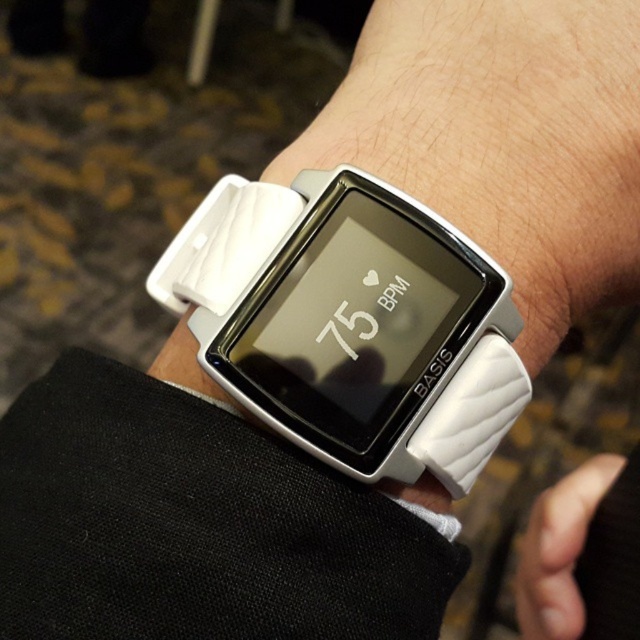
You are a jeweler examining two watches on a display stand. The white rubber watch at center and the white matte wristwatch at center are positioned side by side. Which watch is closer to you?

The white rubber watch at center is closer to the viewer than the white matte wristwatch at center.

You are a technician inspecting a smartwatch. The watch has a rectangular screen showing heart rate and a brand name. Where is the point with coordinates point (349, 323) located on the watch?

The point (349, 323) corresponds to the white rubber watch at center.

You are a customer trying to decide between two smartwatches displayed side by side on a store shelf. The store assistant points out that one is a white rubber watch at center and the other is a white matte wristwatch at center. According to their positions, which one is located on the left side?

The white rubber watch at center is positioned to the left of the white matte wristwatch at center, so the white rubber watch at center is on the left side.